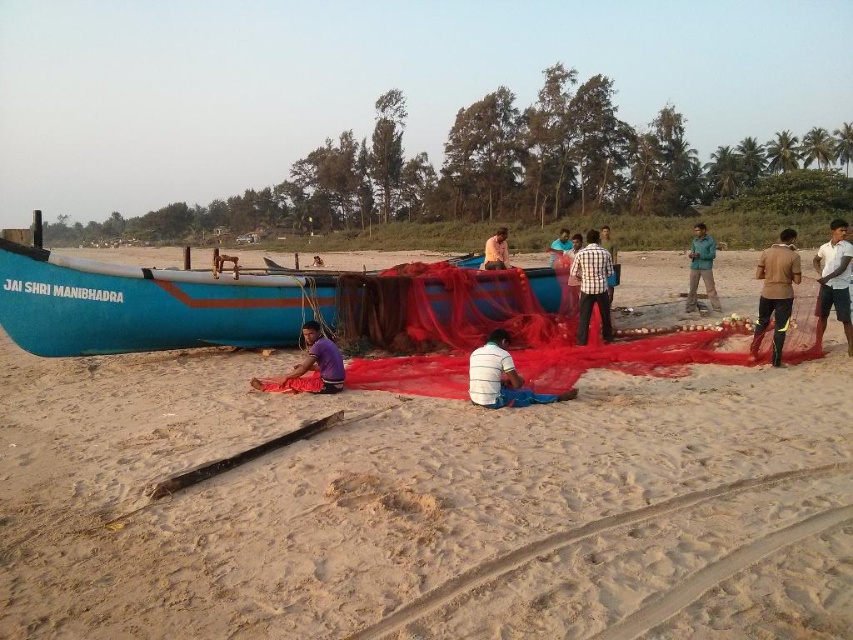
You are a photographer standing at the center of the beach scene. You want to take a photo of the brown leather jacket at right. According to the coordinates provided, where should you position your camera to capture the jacket in the frame?

The brown leather jacket at right is located at coordinates point (775, 291), so you should position your camera to aim towards that coordinate to capture the jacket in the frame.

You are a photographer trying to capture a photo of the beach scene. You want to ensure that both the white cotton shirt at right and the brown fabric at center are visible in the frame. Based on their sizes, which object should you focus on to ensure both are in the shot?

The white cotton shirt at right is narrower than the brown fabric at center, so focusing on the brown fabric at center will help ensure both are visible in the frame since it is wider and can serve as a reference point.

You are a photographer at the beach scene. You need to capture a photo where both the white cotton shirt at right and the purple fabric at center are visible. Which object should you position closer to the camera to ensure both are in frame?

The white cotton shirt at right is taller than the purple fabric at center. To ensure both are visible in the photo, position the white cotton shirt at right closer to the camera so its height doesn